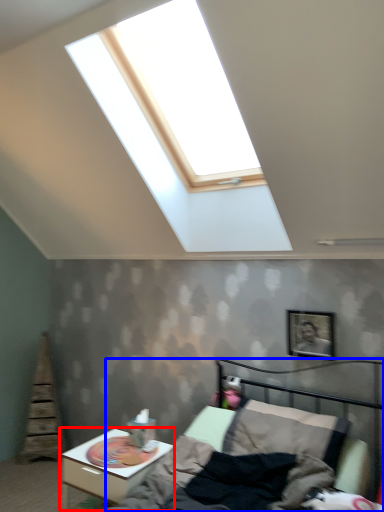
Question: Which object appears farthest to the camera in this image, nightstand (highlighted by a red box) or bed (highlighted by a blue box)?

Choices:
 (A) nightstand
 (B) bed

Answer: (A)